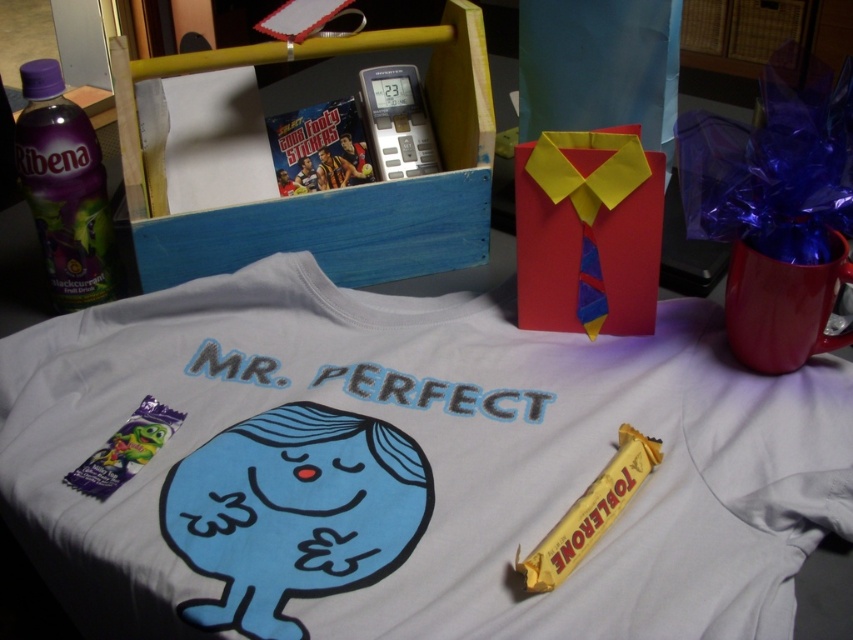
Question: Considering the relative positions of white cotton t-shirt at center and purple plastic bottle at left in the image provided, where is white cotton t-shirt at center located with respect to purple plastic bottle at left?

Choices:
 (A) left
 (B) right

Answer: (B)

Question: From the image, what is the correct spatial relationship of white cotton t-shirt at center in relation to purple plastic bottle at left?

Choices:
 (A) below
 (B) above

Answer: (A)

Question: Among these points, which one is nearest to the camera?

Choices:
 (A) (61, 509)
 (B) (51, 234)

Answer: (A)

Question: Which of the following is the farthest from the observer?

Choices:
 (A) (549, 378)
 (B) (15, 132)

Answer: (B)

Question: Can you confirm if white cotton t-shirt at center is positioned below purple plastic bottle at left?

Choices:
 (A) yes
 (B) no

Answer: (A)